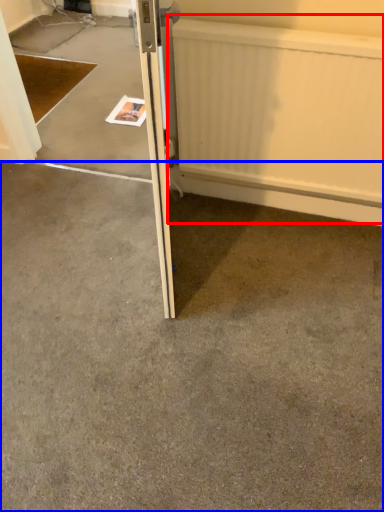
Question: Which object appears closest to the camera in this image, radiator (highlighted by a red box) or concrete (highlighted by a blue box)?

Choices:
 (A) radiator
 (B) concrete

Answer: (B)